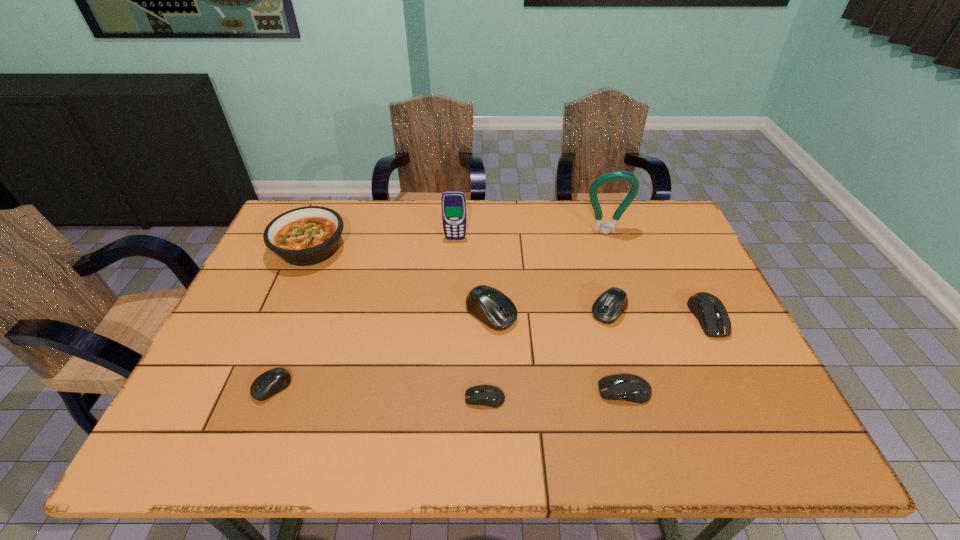
The height and width of the screenshot is (540, 960). I want to click on vacant space in between the second biggest dark computer equipment and the shortest computer equipment, so click(x=555, y=395).

Locate which object ranks fifth in proximity to the smallest dark computer equipment. Please provide its 2D coordinates. Your answer should be formatted as a tuple, i.e. [(x, y)], where the tuple contains the x and y coordinates of a point satisfying the conditions above.

[(709, 310)]

In order to click on object that is the second closest to the smallest black mouse in this screenshot , I will do `click(487, 395)`.

Find the location of `computer equipment that can be found as the fourth closest to the leftmost black mouse`. computer equipment that can be found as the fourth closest to the leftmost black mouse is located at coordinates (609, 306).

Identify which computer equipment is the nearest to the tallest computer equipment. Please provide its 2D coordinates. Your answer should be formatted as a tuple, i.e. [(x, y)], where the tuple contains the x and y coordinates of a point satisfying the conditions above.

[(487, 395)]

Locate which black mouse is the closest to the biggest black mouse. Please provide its 2D coordinates. Your answer should be formatted as a tuple, i.e. [(x, y)], where the tuple contains the x and y coordinates of a point satisfying the conditions above.

[(609, 306)]

Locate which black mouse is the closest to the rightmost black mouse. Please provide its 2D coordinates. Your answer should be formatted as a tuple, i.e. [(x, y)], where the tuple contains the x and y coordinates of a point satisfying the conditions above.

[(490, 306)]

Identify the location of the third closest dark computer equipment relative to the green bottle opener. The height and width of the screenshot is (540, 960). [x=487, y=395].

This screenshot has height=540, width=960. Find the location of `the second closest dark computer equipment relative to the second dark computer equipment from right to left`. the second closest dark computer equipment relative to the second dark computer equipment from right to left is located at coordinates (487, 395).

At what (x,y) coordinates should I click in order to perform the action: click on vacant region that satisfies the following two spatial constraints: 1. on the front-facing side of the second biggest black mouse; 2. on the left side of the cellular telephone. Please return your answer as a coordinate pair (x, y). The height and width of the screenshot is (540, 960). Looking at the image, I should click on (451, 310).